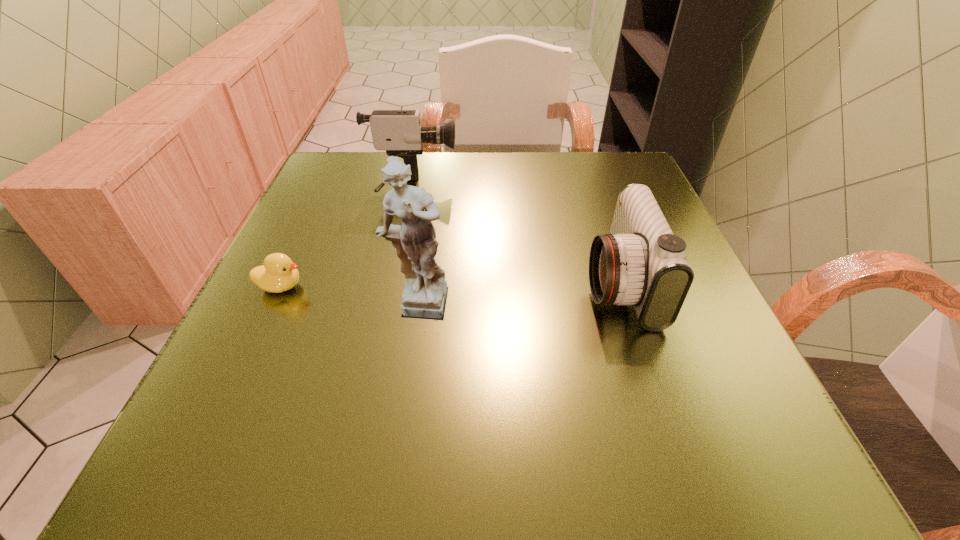
Identify the location of vacant space located on the surface of the right camcorder. The width and height of the screenshot is (960, 540). (546, 283).

Find the location of a particular element. Image resolution: width=960 pixels, height=540 pixels. free spot located 0.140m on the surface of the right camcorder is located at coordinates (506, 283).

Where is `vacant space located on the beak of the leftmost object`? This screenshot has height=540, width=960. vacant space located on the beak of the leftmost object is located at coordinates (489, 287).

Where is `object present at the far edge`? The width and height of the screenshot is (960, 540). object present at the far edge is located at coordinates (399, 132).

Find the location of a particular element. camcorder situated at the left edge is located at coordinates (399, 132).

Find the location of a particular element. duckling present at the left edge is located at coordinates (278, 274).

Where is `object that is positioned at the right edge`? The height and width of the screenshot is (540, 960). object that is positioned at the right edge is located at coordinates (641, 262).

Identify the location of object that is at the far left corner. The width and height of the screenshot is (960, 540). (399, 132).

This screenshot has width=960, height=540. What are the coordinates of `vacant space at the far edge of the desktop` in the screenshot? It's located at (574, 186).

Locate an element on the screen. This screenshot has height=540, width=960. free spot at the near edge of the desktop is located at coordinates (354, 465).